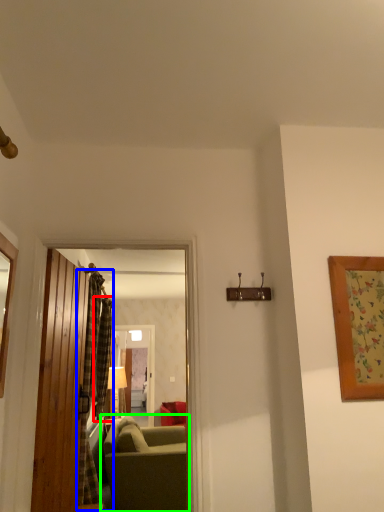
Question: Considering the real-world distances, which object is farthest from curtain (highlighted by a red box)? curtain (highlighted by a blue box) or studio couch (highlighted by a green box)?

Choices:
 (A) curtain
 (B) studio couch

Answer: (B)